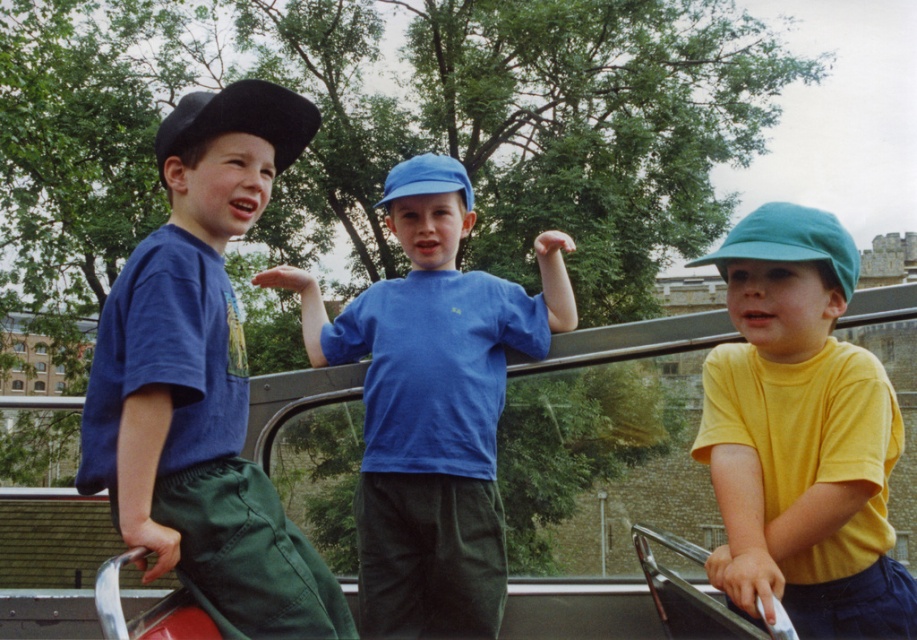
Looking at this image, you are a passenger on the bus and want to know where the blue matte shirt at center is located relative to the other boys. Can you tell me its position using the coordinate system provided?

The blue matte shirt at center is located at point [432,404] according to the coordinate system provided.

You are taking a photo of the scene and want to focus on both point (x=264, y=596) and point (x=423, y=513). Which point should you focus on first to ensure both are in focus?

You should focus on point (x=264, y=596) first because it is closer to the camera than point (x=423, y=513), and adjusting focus from near to far will help ensure both points are in focus.

You are a photographer trying to capture a candid shot of the blue matte shirt at center and the black matte baseball hat at left. Which object is closer to the camera based on their positions?

The blue matte shirt at center is positioned under the black matte baseball hat at left, so the black matte baseball hat at left is closer to the camera.